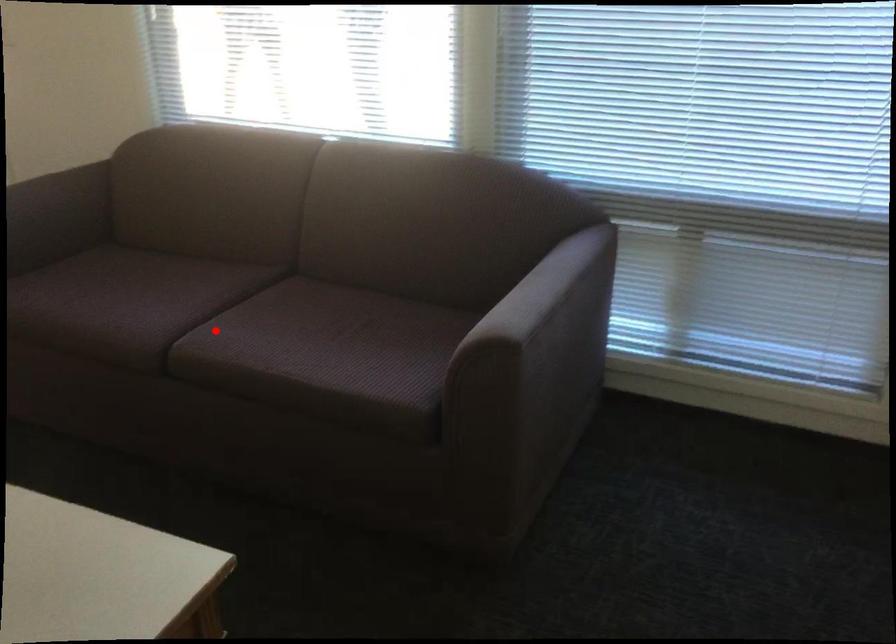
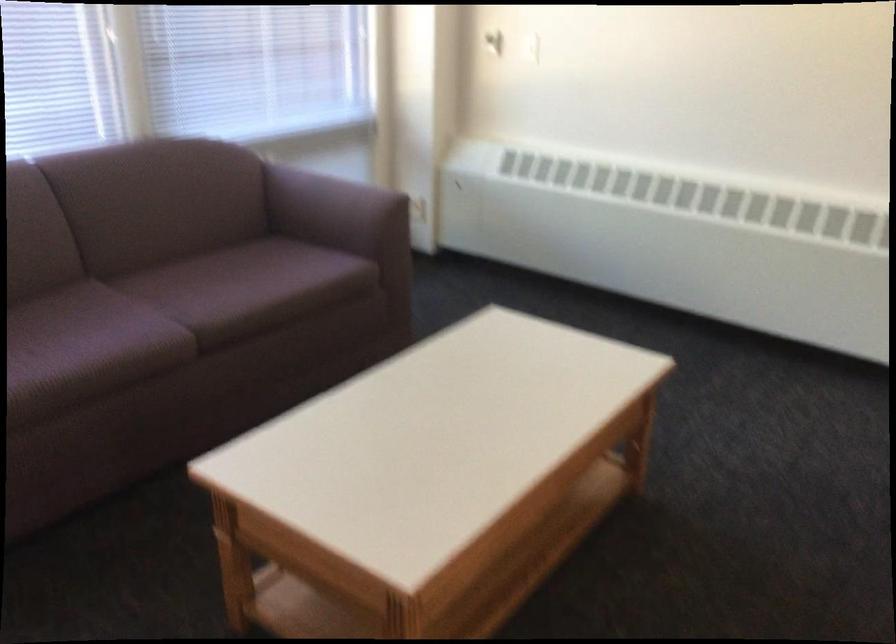
Question: I am providing you with two images of the same scene from different viewpoints. A red point is shown in image1. For the corresponding object point in image2, is it positioned nearer or farther from the camera?

Choices:
 (A) Nearer
 (B) Farther

Answer: (B)